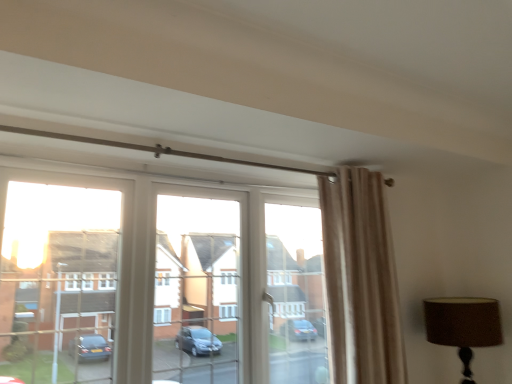
Question: From the image's perspective, is brown fabric lampshade at upper right positioned above or below beige velvet curtain at upper right?

Choices:
 (A) above
 (B) below

Answer: (B)

Question: From a real-world perspective, is brown fabric lampshade at upper right physically located above or below beige velvet curtain at upper right?

Choices:
 (A) below
 (B) above

Answer: (A)

Question: Which object is the farthest from the brown fabric lampshade at upper right?

Choices:
 (A) transparent glass window at center
 (B) beige velvet curtain at upper right

Answer: (A)

Question: Which object is positioned farthest from the beige velvet curtain at upper right?

Choices:
 (A) brown fabric lampshade at upper right
 (B) transparent glass window at center

Answer: (B)